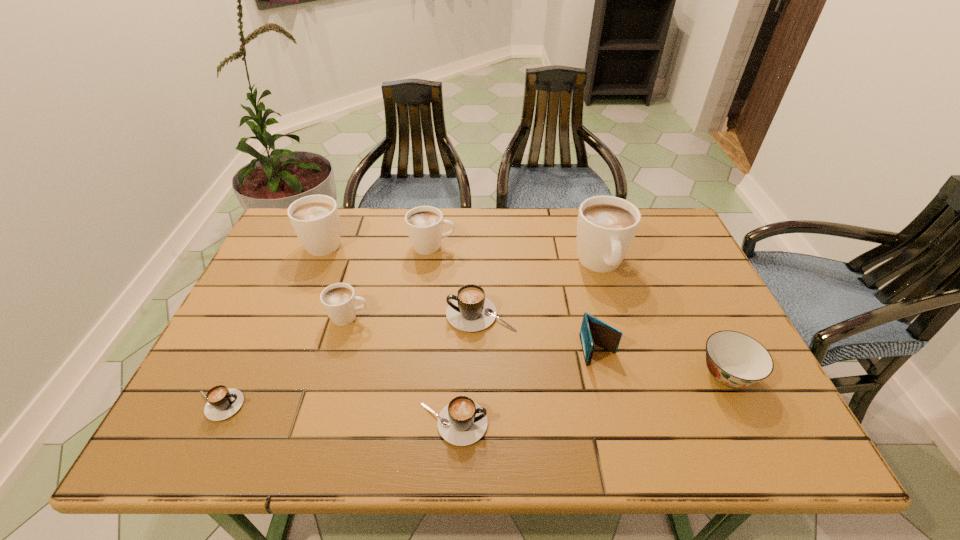
The image size is (960, 540). What are the coordinates of `free spot between the second tallest cappuccino and the shortest object` in the screenshot? It's located at (272, 323).

This screenshot has width=960, height=540. Identify the location of vacant area that lies between the smallest white cappuccino and the shortest object. (283, 361).

Image resolution: width=960 pixels, height=540 pixels. I want to click on object that is the second closest one to the nearest white cappuccino, so click(470, 310).

Locate which object is the eighth closest to the second smallest white cappuccino. Please provide its 2D coordinates. Your answer should be formatted as a tuple, i.e. [(x, y)], where the tuple contains the x and y coordinates of a point satisfying the conditions above.

[(735, 359)]

Locate an element on the screen. cappuccino that is the seventh closest one to the rightmost object is located at coordinates (222, 403).

Locate which cappuccino ranks fifth in proximity to the sixth shortest cappuccino. Please provide its 2D coordinates. Your answer should be formatted as a tuple, i.e. [(x, y)], where the tuple contains the x and y coordinates of a point satisfying the conditions above.

[(462, 422)]

Point out which white cappuccino is positioned as the nearest to the rightmost white cappuccino. Please provide its 2D coordinates. Your answer should be formatted as a tuple, i.e. [(x, y)], where the tuple contains the x and y coordinates of a point satisfying the conditions above.

[(424, 224)]

Select which white cappuccino is the fourth closest to the soup bowl. Please provide its 2D coordinates. Your answer should be formatted as a tuple, i.e. [(x, y)], where the tuple contains the x and y coordinates of a point satisfying the conditions above.

[(315, 219)]

Identify which black cappuccino is the closest to the wallet. Please provide its 2D coordinates. Your answer should be formatted as a tuple, i.e. [(x, y)], where the tuple contains the x and y coordinates of a point satisfying the conditions above.

[(470, 310)]

Point out which black cappuccino is positioned as the second nearest to the smallest black cappuccino. Please provide its 2D coordinates. Your answer should be formatted as a tuple, i.e. [(x, y)], where the tuple contains the x and y coordinates of a point satisfying the conditions above.

[(470, 310)]